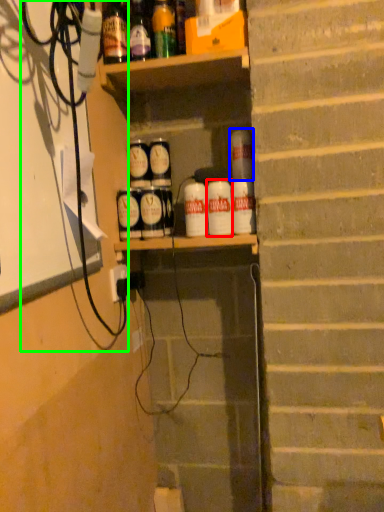
Question: Considering the real-world distances, which object is closest to beverage (highlighted by a red box)? beverage (highlighted by a blue box) or cable (highlighted by a green box).

Choices:
 (A) beverage
 (B) cable

Answer: (A)